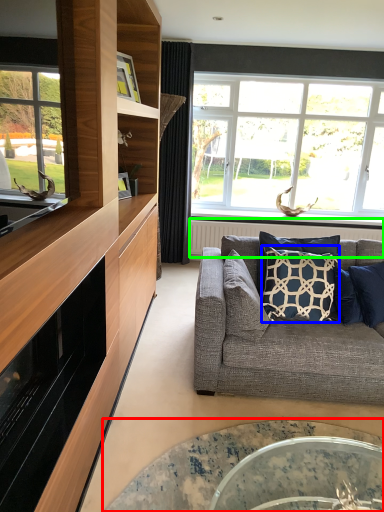
Question: Which object is the farthest from coffee table (highlighted by a red box)? Choose among these: pillow (highlighted by a blue box) or radiator (highlighted by a green box).

Choices:
 (A) pillow
 (B) radiator

Answer: (B)